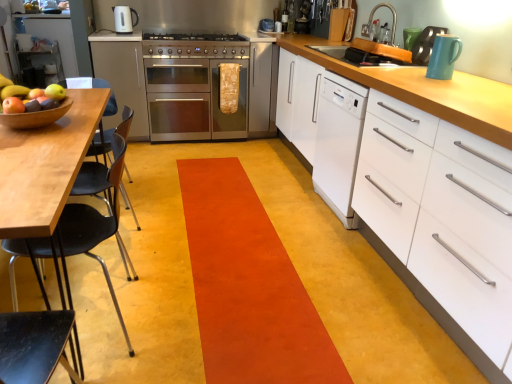
Question: Is point (150, 81) positioned closer to the camera than point (70, 304)?

Choices:
 (A) farther
 (B) closer

Answer: (A)

Question: Considering the relative positions of stainless steel oven at center and black plastic chair at left in the image provided, is stainless steel oven at center to the left or to the right of black plastic chair at left?

Choices:
 (A) left
 (B) right

Answer: (B)

Question: Considering the real-world distances, which object is closest to the orange plastic sink at upper center?

Choices:
 (A) white matte cabinet at right, which appears as the second cabinetry when viewed from the top
 (B) matte brown apple at left
 (C) metallic faucet at upper right, the 1th appliance in the top-to-bottom sequence
 (D) matte black kettle at upper center, which appears as the 2th kitchen appliance when viewed from the right
 (E) white glossy dishwasher at center right

Answer: (E)

Question: Which object is the farthest from the teal glossy mug at upper right, acting as the second appliance starting from the top?

Choices:
 (A) matte brown apple at left
 (B) black plastic chair at left
 (C) white matte cabinet at right, the second cabinetry when ordered from left to right
 (D) matte black kettle at upper center, acting as the first kitchen appliance starting from the back
 (E) satin silver oven at center, the 1th cabinetry viewed from the top

Answer: (D)